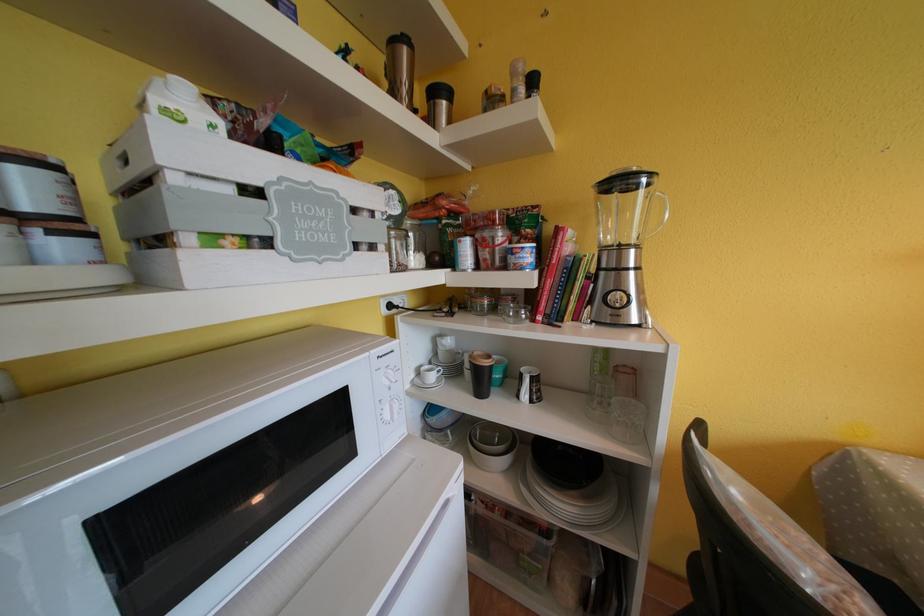
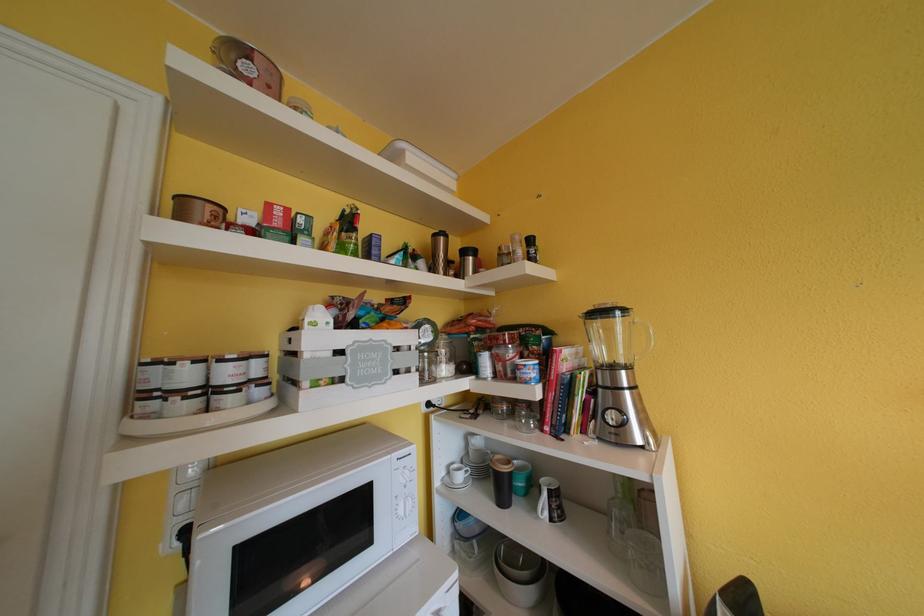
Find the pixel in the second image that matches point 634,300 in the first image.

(633, 418)